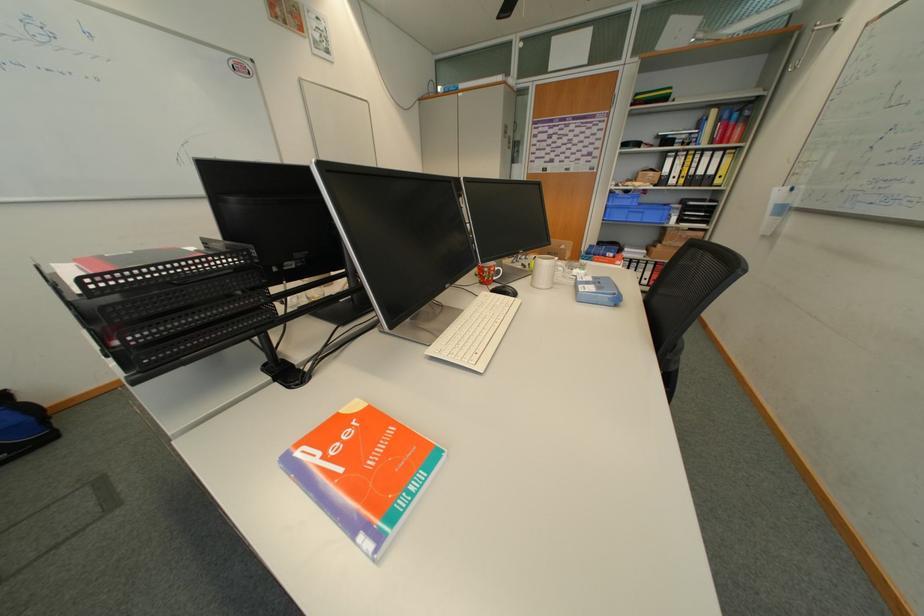
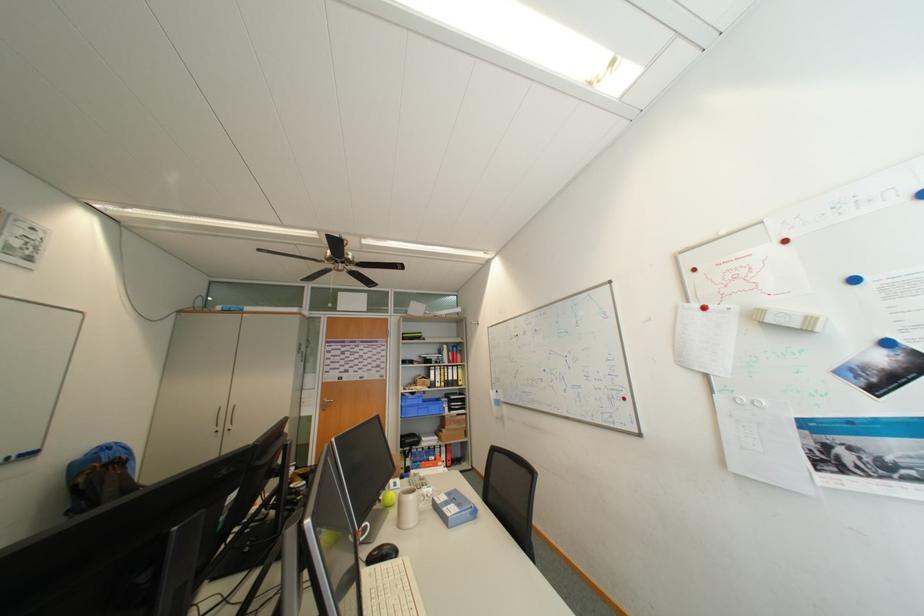
Where in the second image is the point corresponding to pixel 504 292 from the first image?

(381, 562)